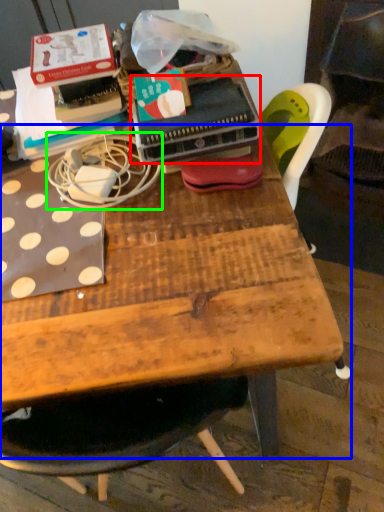
Question: Which is farther away from paperback book (highlighted by a red box)? table (highlighted by a blue box) or string (highlighted by a green box)?

Choices:
 (A) table
 (B) string

Answer: (A)